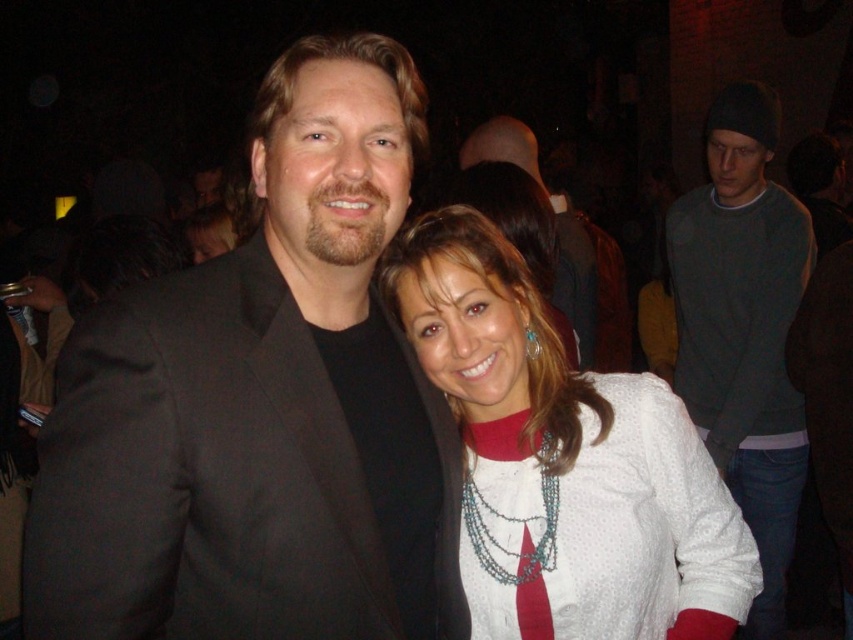
Question: Which of the following is the closest to the observer?

Choices:
 (A) (488, 154)
 (B) (534, 502)
 (C) (506, 458)
 (D) (735, 164)

Answer: (B)

Question: Does black matte suit at center have a larger size compared to teal beaded necklace at center?

Choices:
 (A) yes
 (B) no

Answer: (A)

Question: From the image, what is the correct spatial relationship of white dotted shirt at center in relation to matte black suit at center?

Choices:
 (A) below
 (B) above

Answer: (A)

Question: Which object is closer to the camera taking this photo?

Choices:
 (A) white dotted shirt at center
 (B) dark gray sweater at right
 (C) matte black suit at center
 (D) teal beaded necklace at center

Answer: (A)

Question: Which point appears closest to the camera in this image?

Choices:
 (A) (305, 332)
 (B) (733, 512)
 (C) (517, 416)
 (D) (485, 132)

Answer: (A)

Question: Where is black matte suit at center located in relation to teal beaded necklace at center in the image?

Choices:
 (A) right
 (B) left

Answer: (B)